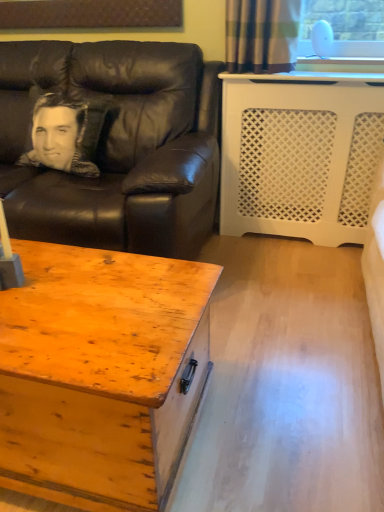
I want to click on free location above wooden chest at lower left (from a real-world perspective), so tap(74, 310).